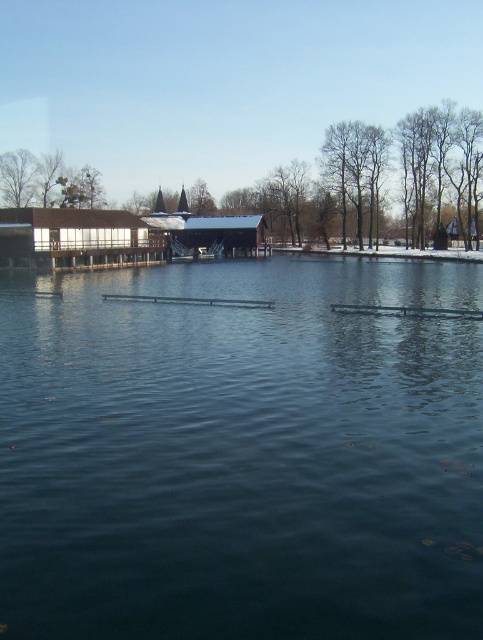
Is dark blue water at center taller than brown leafless tree at left?

In fact, dark blue water at center may be shorter than brown leafless tree at left.

Between point (91, 296) and point (33, 170), which one is positioned behind?

The point (33, 170) is more distant.

Between point (416, 508) and point (27, 157), which one is positioned in front?

Point (416, 508) is more forward.

Where is `dark blue water at center`? The height and width of the screenshot is (640, 483). dark blue water at center is located at coordinates (241, 454).